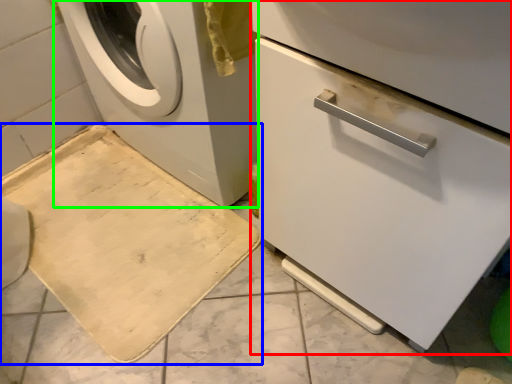
Question: Based on their relative distances, which object is nearer to machine (highlighted by a red box)? Choose from bath mat (highlighted by a blue box) and washing machine (highlighted by a green box).

Choices:
 (A) bath mat
 (B) washing machine

Answer: (B)